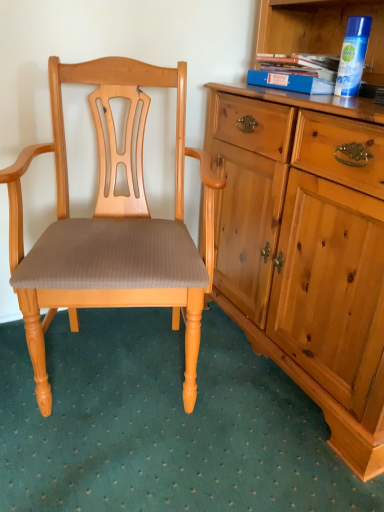
Question: Visually, is blue hardcover book at upper right positioned to the left or to the right of matte wood chair at center?

Choices:
 (A) right
 (B) left

Answer: (A)

Question: From a real-world perspective, is blue hardcover book at upper right physically located above or below matte wood chair at center?

Choices:
 (A) above
 (B) below

Answer: (A)

Question: Based on their sizes in the image, would you say blue hardcover book at upper right is bigger or smaller than matte wood chair at center?

Choices:
 (A) big
 (B) small

Answer: (B)

Question: Considering the positions of matte wood chair at center and blue hardcover book at upper right in the image, is matte wood chair at center bigger or smaller than blue hardcover book at upper right?

Choices:
 (A) small
 (B) big

Answer: (B)

Question: From their relative heights in the image, would you say matte wood chair at center is taller or shorter than blue hardcover book at upper right?

Choices:
 (A) short
 (B) tall

Answer: (B)

Question: Is point (132, 192) positioned closer to the camera than point (299, 91)?

Choices:
 (A) farther
 (B) closer

Answer: (A)

Question: Is matte wood chair at center wider or thinner than blue hardcover book at upper right?

Choices:
 (A) thin
 (B) wide

Answer: (B)